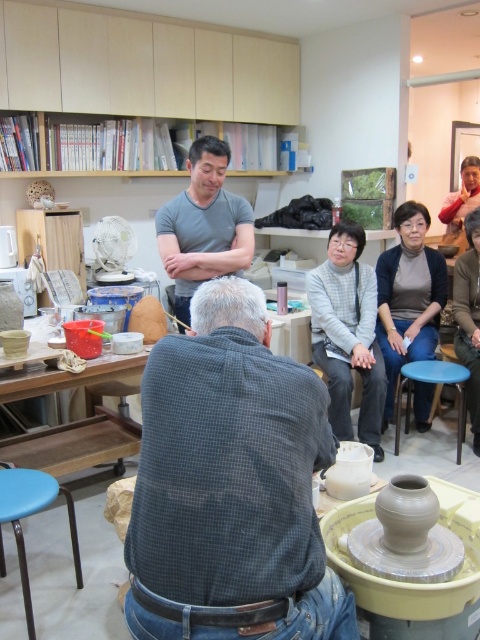
Question: Which point is farther from the camera taking this photo?

Choices:
 (A) (207, 451)
 (B) (475, 346)

Answer: (B)

Question: Is gray wool sweater at center to the left of gray flannel shirt at center from the viewer's perspective?

Choices:
 (A) no
 (B) yes

Answer: (B)

Question: Among these objects, which one is nearest to the camera?

Choices:
 (A) blue plastic stool at lower center
 (B) dark gray checkered shirt at center
 (C) gray flannel shirt at center

Answer: (B)

Question: Estimate the real-world distances between objects in this image. Which object is closer to the gray cotton shirt at center?

Choices:
 (A) dark gray checkered shirt at center
 (B) gray wool sweater at center

Answer: (B)

Question: Does dark gray checkered shirt at center appear on the left side of blue plastic stool at lower center?

Choices:
 (A) no
 (B) yes

Answer: (B)

Question: Considering the relative positions of dark gray checkered shirt at center and wooden table at lower left in the image provided, where is dark gray checkered shirt at center located with respect to wooden table at lower left?

Choices:
 (A) left
 (B) right

Answer: (B)